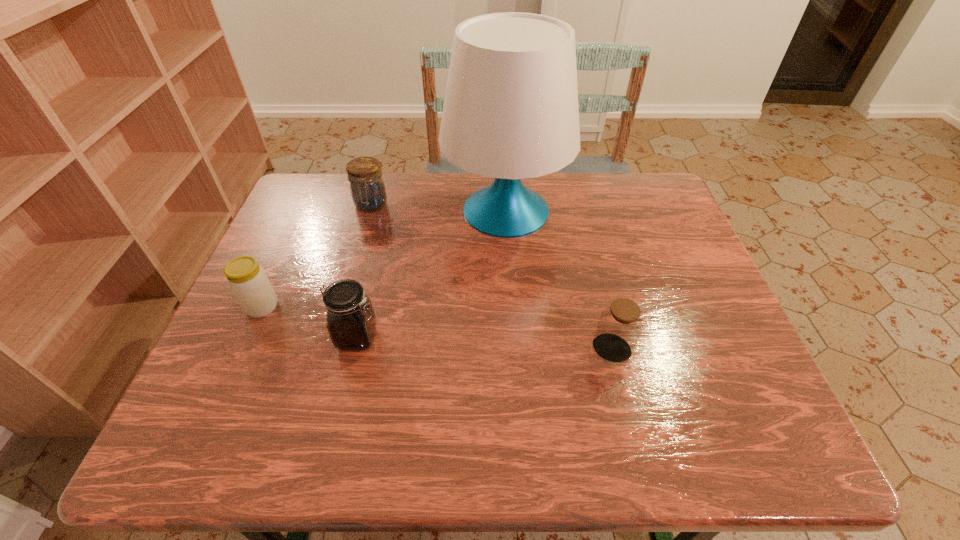
This screenshot has height=540, width=960. I want to click on jar that is the third nearest to the third nearest object, so click(x=620, y=324).

At what (x,y) coordinates should I click in order to perform the action: click on vacant region that satisfies the following two spatial constraints: 1. on the front-facing side of the table lamp; 2. on the front side of the third nearest jar. Please return your answer as a coordinate pair (x, y). Looking at the image, I should click on (512, 307).

The width and height of the screenshot is (960, 540). In order to click on free location that satisfies the following two spatial constraints: 1. on the lid of the farthest jar; 2. on the right side of the rightmost jar in this screenshot , I will do `click(330, 349)`.

I want to click on free spot that satisfies the following two spatial constraints: 1. on the lid of the farthest jar; 2. on the right side of the rightmost jar, so click(330, 349).

Find the location of a particular element. vacant point that satisfies the following two spatial constraints: 1. on the lid of the rightmost jar; 2. on the right side of the farthest jar is located at coordinates (330, 349).

Find the location of a particular element. free space that satisfies the following two spatial constraints: 1. on the back side of the rightmost jar; 2. on the front-facing side of the table lamp is located at coordinates (577, 211).